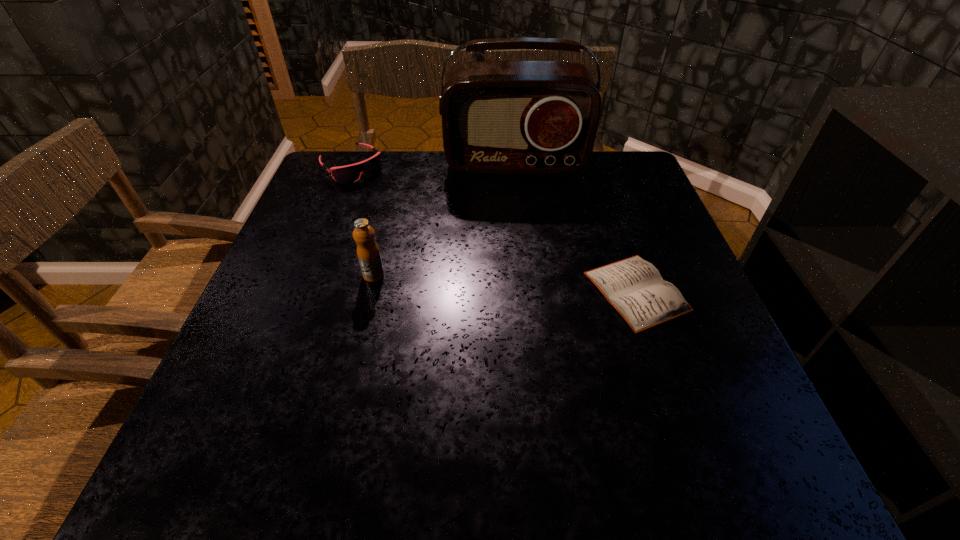
This screenshot has width=960, height=540. What are the coordinates of `free space that is in between the shortest object and the radio receiver` in the screenshot? It's located at (576, 227).

Locate an element on the screen. free spot between the diary and the tallest object is located at coordinates (576, 227).

Where is `vacant area that lies between the radio receiver and the third tallest object`? Image resolution: width=960 pixels, height=540 pixels. vacant area that lies between the radio receiver and the third tallest object is located at coordinates (433, 165).

Identify the location of free space between the diary and the second object from left to right. The image size is (960, 540). (505, 283).

This screenshot has width=960, height=540. I want to click on vacant space that's between the tallest object and the shortest object, so click(x=576, y=227).

You are a GUI agent. You are given a task and a screenshot of the screen. Output one action in this format:
    pyautogui.click(x=<x>, y=<y>)
    Task: Click on the vacant point located between the tallest object and the diary
    
    Given the screenshot: What is the action you would take?
    pyautogui.click(x=576, y=227)

Identify which object is located as the second nearest to the second tallest object. Please provide its 2D coordinates. Your answer should be formatted as a tuple, i.e. [(x, y)], where the tuple contains the x and y coordinates of a point satisfying the conditions above.

[(498, 117)]

At what (x,y) coordinates should I click in order to perform the action: click on object that is the closest to the third shortest object. Please return your answer as a coordinate pair (x, y). Looking at the image, I should click on (351, 173).

At what (x,y) coordinates should I click in order to perform the action: click on free spot that satisfies the following two spatial constraints: 1. on the front side of the shortest object; 2. on the right side of the leftmost object. Please return your answer as a coordinate pair (x, y). Looking at the image, I should click on (302, 292).

Where is `vacant space that satisfies the following two spatial constraints: 1. on the front side of the radio receiver; 2. on the right side of the shortest object`? vacant space that satisfies the following two spatial constraints: 1. on the front side of the radio receiver; 2. on the right side of the shortest object is located at coordinates (529, 292).